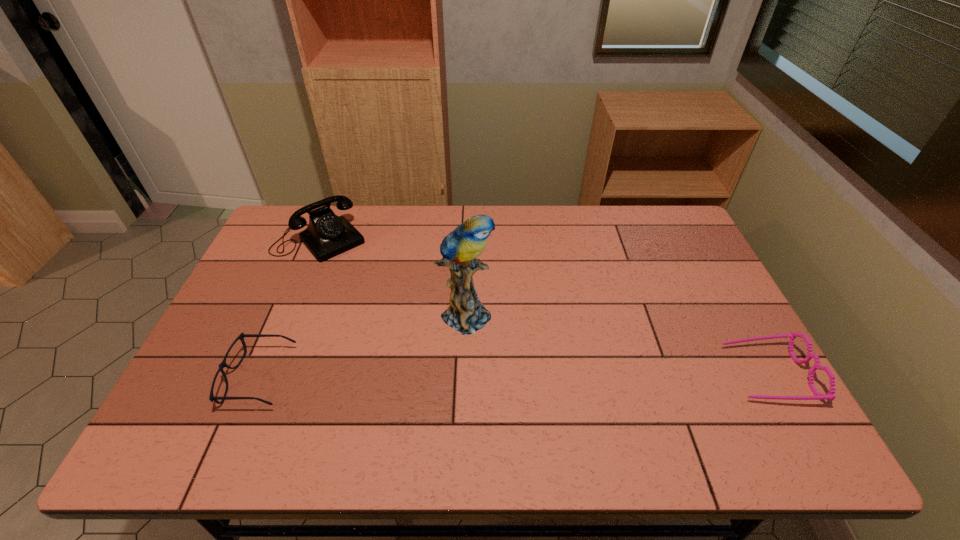
Find the location of a particular element. The image size is (960, 540). vacant space situated 0.170m on the arms of the second shortest object is located at coordinates (662, 374).

This screenshot has width=960, height=540. I want to click on vacant position located on the arms of the second shortest object, so click(x=686, y=374).

Where is `vacant position located 0.110m on the front face of the farthest object`? vacant position located 0.110m on the front face of the farthest object is located at coordinates (359, 276).

Where is `vacant space located 0.120m on the front face of the farthest object`? This screenshot has height=540, width=960. vacant space located 0.120m on the front face of the farthest object is located at coordinates (361, 278).

Where is `vacant space located on the front face of the farthest object`? Image resolution: width=960 pixels, height=540 pixels. vacant space located on the front face of the farthest object is located at coordinates (410, 333).

The height and width of the screenshot is (540, 960). Identify the location of vacant space located on the face of the third object from left to right. (587, 382).

Image resolution: width=960 pixels, height=540 pixels. What are the coordinates of `free space located 0.160m on the face of the third object from left to right` in the screenshot? It's located at coord(538,355).

Where is `vacant space located on the face of the third object from left to right`? The width and height of the screenshot is (960, 540). vacant space located on the face of the third object from left to right is located at coordinates coord(605,393).

Where is `object situated at the far edge`? object situated at the far edge is located at coordinates (327, 235).

Find the location of a particular element. The image size is (960, 540). spectacles that is at the left edge is located at coordinates (223, 364).